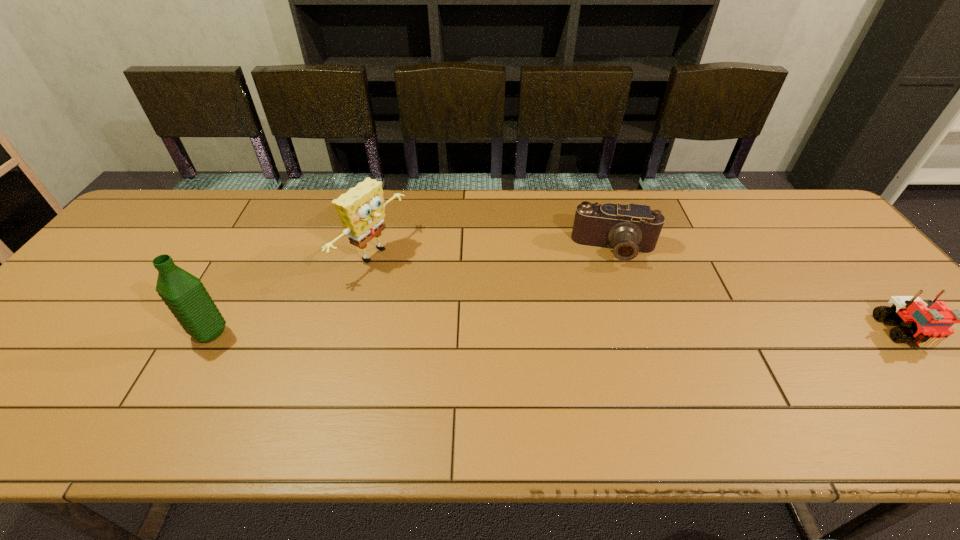
Locate an element on the screen. The height and width of the screenshot is (540, 960). vacant area situated on the face of the third object from right to left is located at coordinates (422, 285).

At what (x,y) coordinates should I click in order to perform the action: click on camera situated at the far edge. Please return your answer as a coordinate pair (x, y). Looking at the image, I should click on (628, 229).

The width and height of the screenshot is (960, 540). I want to click on sponge present at the far edge, so click(361, 209).

Where is `object that is at the right edge`? object that is at the right edge is located at coordinates (930, 323).

Find the location of a particular element. This screenshot has height=540, width=960. blank space at the far edge is located at coordinates 660,191.

Image resolution: width=960 pixels, height=540 pixels. In the image, there is a desktop. In order to click on vacant space at the near edge in this screenshot , I will do `click(309, 379)`.

Identify the location of free spot at the left edge of the desktop. (153, 240).

Image resolution: width=960 pixels, height=540 pixels. I want to click on vacant area at the far right corner, so click(x=791, y=206).

Identify the location of blank space at the near right corner. This screenshot has height=540, width=960. (958, 387).

Find the location of a particular element. vacant area that lies between the Lego and the third object from right to left is located at coordinates (639, 293).